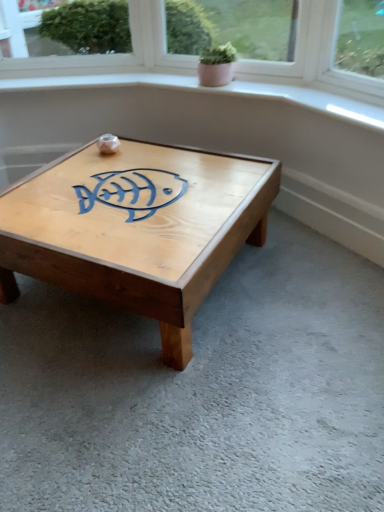
The image size is (384, 512). Identify the location of vacant space to the right of pink matte pot at upper center. (251, 85).